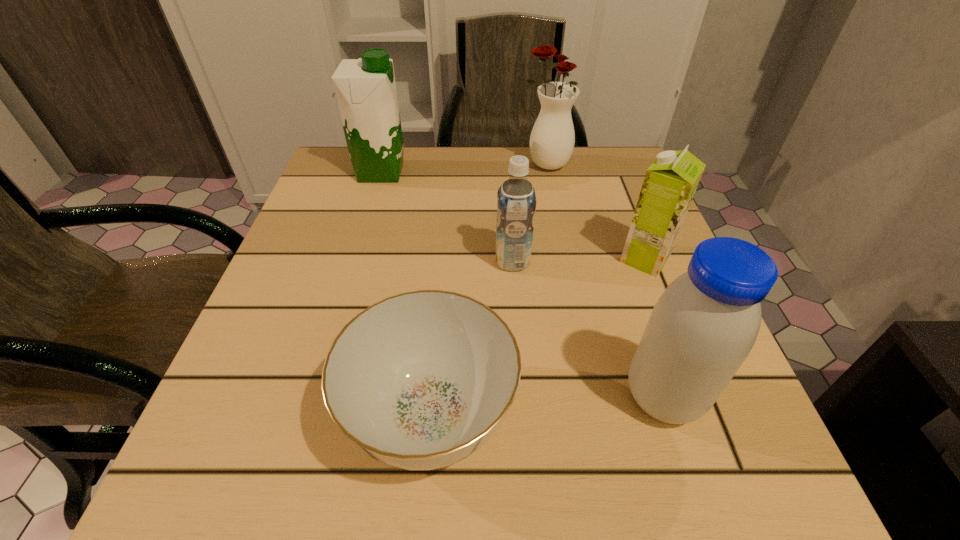
Identify the location of vase. (552, 139).

The image size is (960, 540). Identify the location of the farthest soya milk. (365, 88).

What are the coordinates of `the nearest soya milk` in the screenshot? It's located at click(704, 325).

The height and width of the screenshot is (540, 960). Identify the location of the third soya milk from right to left. (516, 201).

Image resolution: width=960 pixels, height=540 pixels. I want to click on chinaware, so click(x=421, y=380).

Where is `free space located on the left of the vase`? Image resolution: width=960 pixels, height=540 pixels. free space located on the left of the vase is located at coordinates (413, 165).

Locate an element on the screen. Image resolution: width=960 pixels, height=540 pixels. vacant space located on the front-facing side of the farthest soya milk is located at coordinates (448, 172).

This screenshot has height=540, width=960. I want to click on vacant region located 0.050m on the back of the nearest soya milk, so click(643, 338).

What are the coordinates of `free spot located on the label of the second soya milk from left to right` in the screenshot? It's located at (325, 261).

What are the coordinates of `vacant position located on the label of the second soya milk from left to right` in the screenshot? It's located at (352, 261).